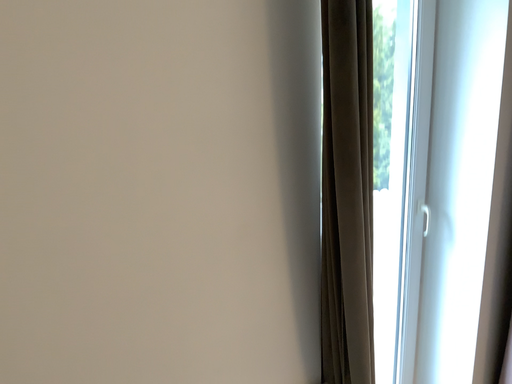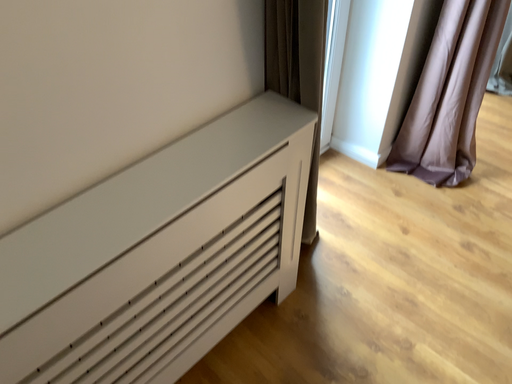
Question: Which way did the camera rotate in the video?

Choices:
 (A) rotated left
 (B) rotated right

Answer: (B)